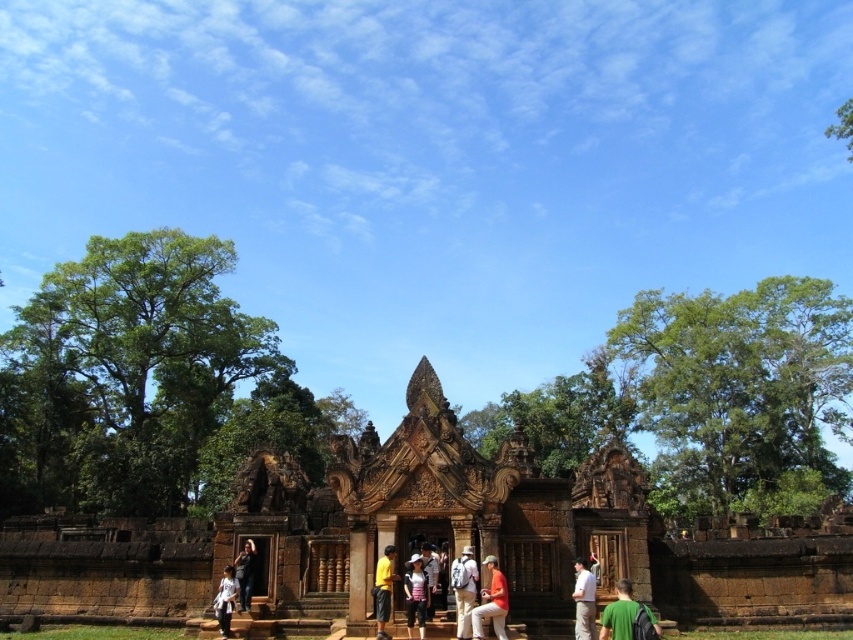
Question: Which object is farther from the camera taking this photo?

Choices:
 (A) orange fabric shirt at lower center
 (B) matte black shirt at center
 (C) light brown fabric shirt at center
 (D) yellow fabric pants at center

Answer: (C)

Question: Is the position of green fabric backpack at lower right more distant than that of yellow fabric pants at center?

Choices:
 (A) no
 (B) yes

Answer: (A)

Question: Which point is closer to the camera taking this photo?

Choices:
 (A) (428, 579)
 (B) (380, 577)

Answer: (B)

Question: Considering the relative positions of white fabric backpack at center and white cotton shirt at lower center in the image provided, where is white fabric backpack at center located with respect to white cotton shirt at lower center?

Choices:
 (A) above
 (B) below

Answer: (B)

Question: Does orange fabric shirt at lower center have a larger size compared to dark brown leather jacket at lower center?

Choices:
 (A) no
 (B) yes

Answer: (A)

Question: Based on their relative distances, which object is farther from the orange fabric shirt at lower center?

Choices:
 (A) white cotton shirt at lower center
 (B) green fabric backpack at lower right

Answer: (A)